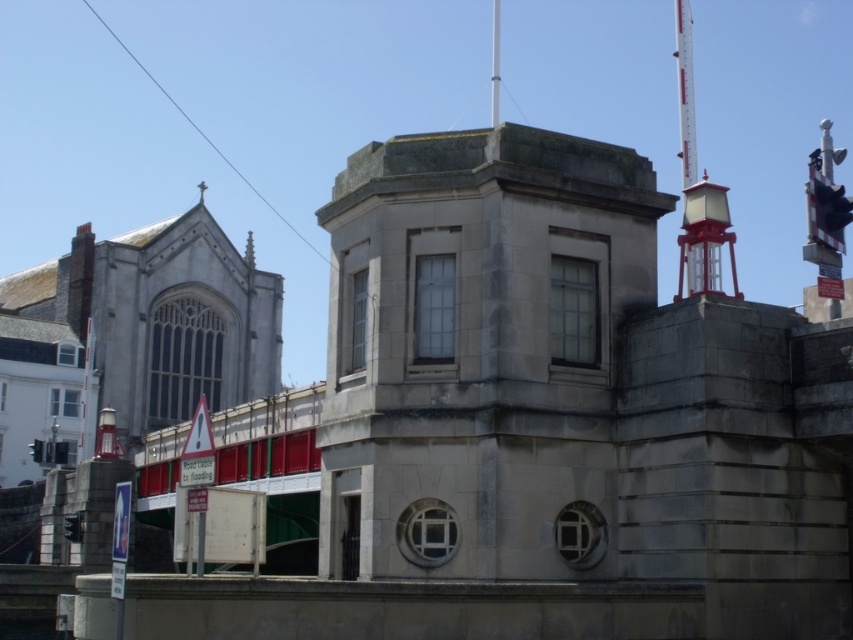
You are standing at the center of the urban scene described. You need to locate the red painted metal mast at upper right. According to the coordinates provided, where exactly should you look to find it?

The red painted metal mast at upper right is located at point (685, 92).

You are a maintenance worker needing to inspect two structures, the red painted metal mast at upper right and the metallic pole at upper center. Given that your inspection equipment has a maximum effective range of 60 meters, can you assess both structures without moving your position?

The red painted metal mast at upper right is 59.59 meters away from the metallic pole at upper center. Since the distance between them is within the 60 meters range of your equipment, you can assess both structures without moving your position.